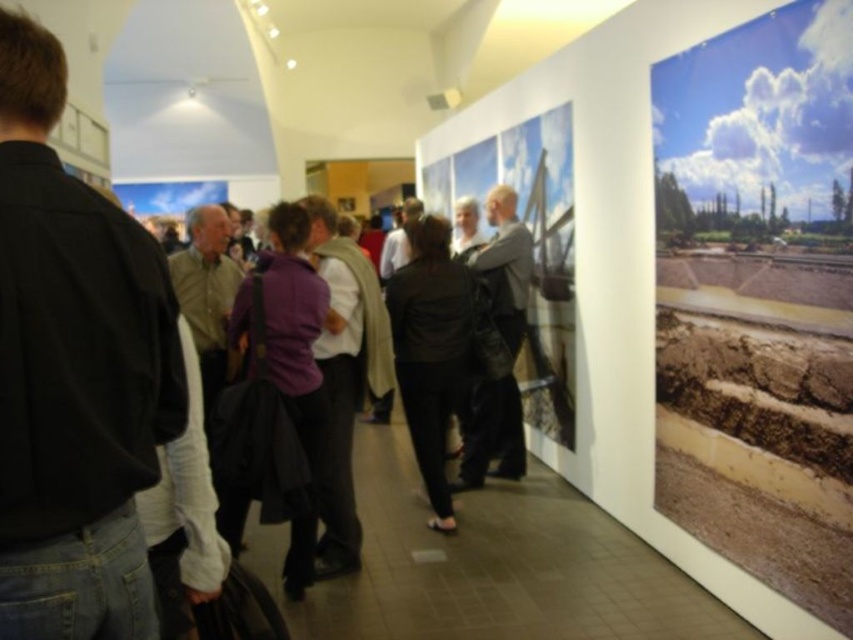
Question: Is black matte jacket at center below light brown leather jacket at center?

Choices:
 (A) yes
 (B) no

Answer: (A)

Question: Observing the image, what is the correct spatial positioning of purple fabric jacket at center in reference to light brown leather jacket at center?

Choices:
 (A) below
 (B) above

Answer: (A)

Question: Is black matte jacket at center thinner than light brown leather jacket at center?

Choices:
 (A) yes
 (B) no

Answer: (A)

Question: Which object is farther from the camera taking this photo?

Choices:
 (A) black shirt at left
 (B) light brown leather jacket at center
 (C) black matte jacket at center
 (D) purple fabric jacket at center

Answer: (B)

Question: Which point appears farthest from the camera in this image?

Choices:
 (A) (300, 332)
 (B) (496, 220)
 (C) (44, 172)

Answer: (B)

Question: Which object is closer to the camera taking this photo?

Choices:
 (A) black shirt at left
 (B) light brown leather jacket at center

Answer: (A)